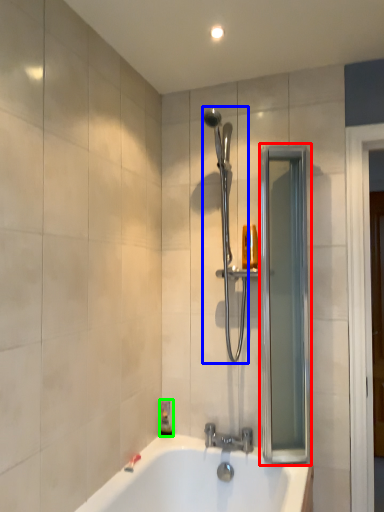
Question: Which object is the closest to the screen door (highlighted by a red box)? Choose among these: shower (highlighted by a blue box) or soap dispenser (highlighted by a green box).

Choices:
 (A) shower
 (B) soap dispenser

Answer: (A)